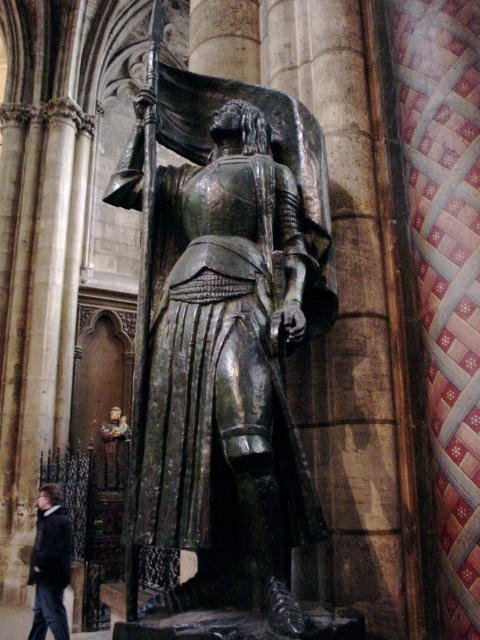
You are an interior designer planning to place a new decorative item that is 2 meters wide in the cathedral. Considering the space occupied by the bronze statue at center and the dark gray wool coat at lower left, which object might pose a challenge in terms of space availability?

The dark gray wool coat at lower left has a greater width than the bronze statue at center, so it might pose a challenge for placing the 2 meter wide decorative item due to its larger width.